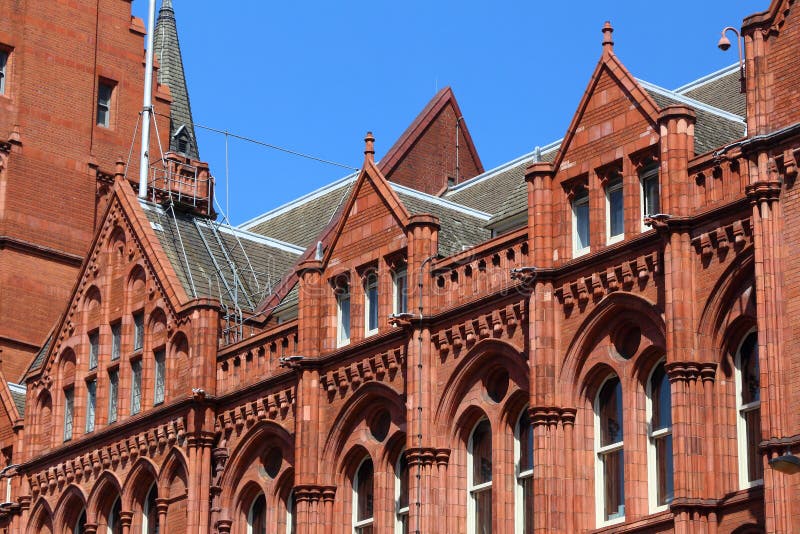
This screenshot has height=534, width=800. Identify the location of gray ladder. (214, 250).